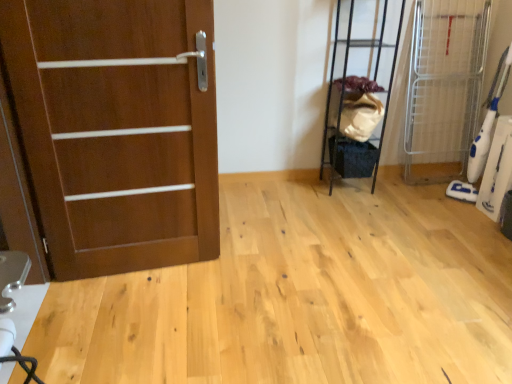
Locate an element on the screen. This screenshot has height=384, width=512. empty space that is to the right of black metal shelf at upper right, which ranks as the second elevator in right-to-left order is located at coordinates (393, 189).